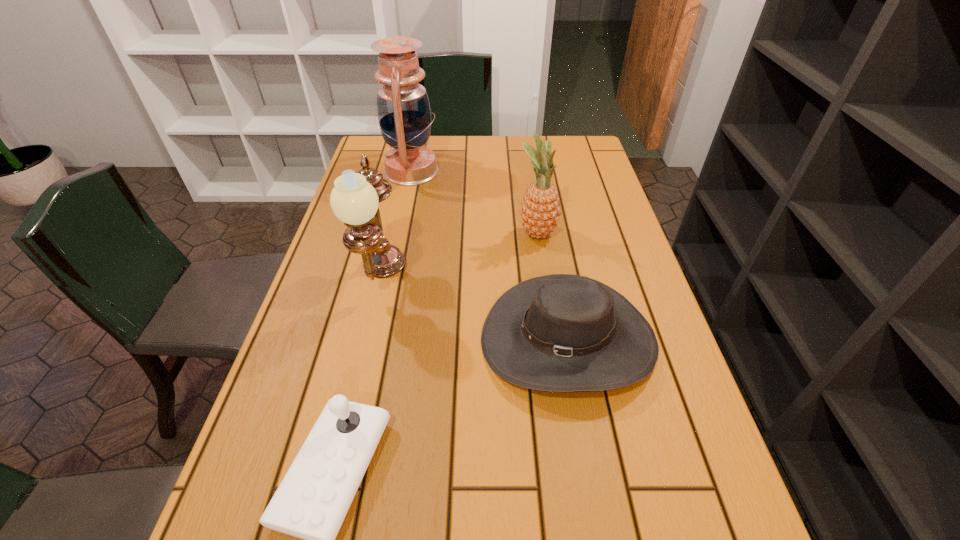
Identify the location of vacant region between the third shortest object and the shorter oil lamp. The image size is (960, 540). (459, 256).

You are a GUI agent. You are given a task and a screenshot of the screen. Output one action in this format:
    pyautogui.click(x=<x>, y=<y>)
    Task: Click on the vacant space in between the shorter oil lamp and the pineapple
    The width and height of the screenshot is (960, 540).
    Given the screenshot: What is the action you would take?
    pyautogui.click(x=459, y=256)

Identify the location of free spot between the farthest object and the shorter oil lamp. The height and width of the screenshot is (540, 960). (396, 225).

Identify which object is the closest to the nearer oil lamp. Please provide its 2D coordinates. Your answer should be formatted as a tuple, i.e. [(x, y)], where the tuple contains the x and y coordinates of a point satisfying the conditions above.

[(561, 332)]

Locate which object ranks second in proximity to the farther oil lamp. Please provide its 2D coordinates. Your answer should be formatted as a tuple, i.e. [(x, y)], where the tuple contains the x and y coordinates of a point satisfying the conditions above.

[(540, 211)]

In order to click on blank space that satisfies the following two spatial constraints: 1. on the back side of the shorter oil lamp; 2. on the right side of the pineapple in this screenshot , I will do `click(392, 234)`.